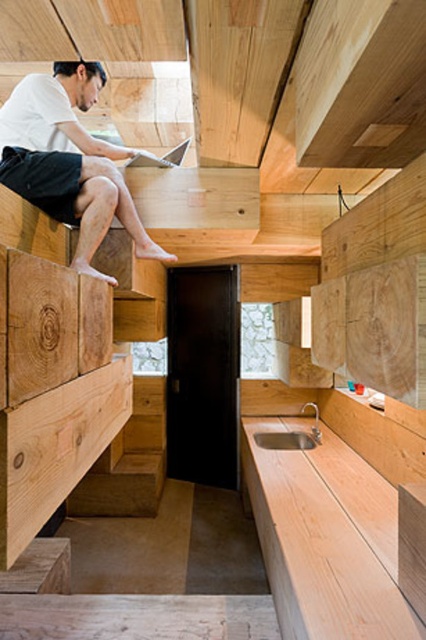
Is light wood/rough wooden surface at lower right closer to the viewer compared to matte white shirt at upper left?

Yes, it is in front of matte white shirt at upper left.

Which is below, light wood/rough wooden surface at lower right or matte white shirt at upper left?

light wood/rough wooden surface at lower right

Does point (324, 592) lie behind point (37, 195)?

No, (324, 592) is closer to viewer.

The height and width of the screenshot is (640, 426). What are the coordinates of `light wood/rough wooden surface at lower right` in the screenshot? It's located at (327, 538).